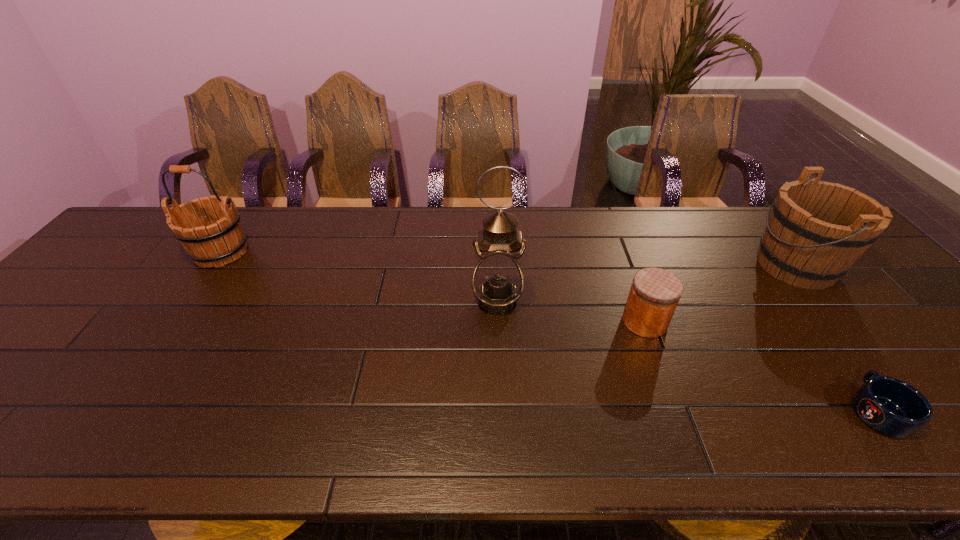
The image size is (960, 540). What are the coordinates of `oil lamp` in the screenshot? It's located at (497, 281).

Locate an element on the screen. The width and height of the screenshot is (960, 540). the tallest object is located at coordinates (497, 281).

Where is `the leftmost object`? Image resolution: width=960 pixels, height=540 pixels. the leftmost object is located at coordinates (223, 241).

Where is `the right wine bucket`? This screenshot has height=540, width=960. the right wine bucket is located at coordinates (817, 230).

At what (x,y) coordinates should I click in order to perform the action: click on the shorter wine bucket. Please return your answer as a coordinate pair (x, y). The height and width of the screenshot is (540, 960). Looking at the image, I should click on (817, 230).

The image size is (960, 540). Identify the location of jar. (654, 294).

Find the location of a particular element. This screenshot has height=540, width=960. the fourth tallest object is located at coordinates (654, 294).

Identify the location of the nearest object. (892, 407).

Find the location of `the shortest object`. the shortest object is located at coordinates (892, 407).

Identify the location of free region located on the front of the fourth object from right to left. This screenshot has width=960, height=540. (500, 378).